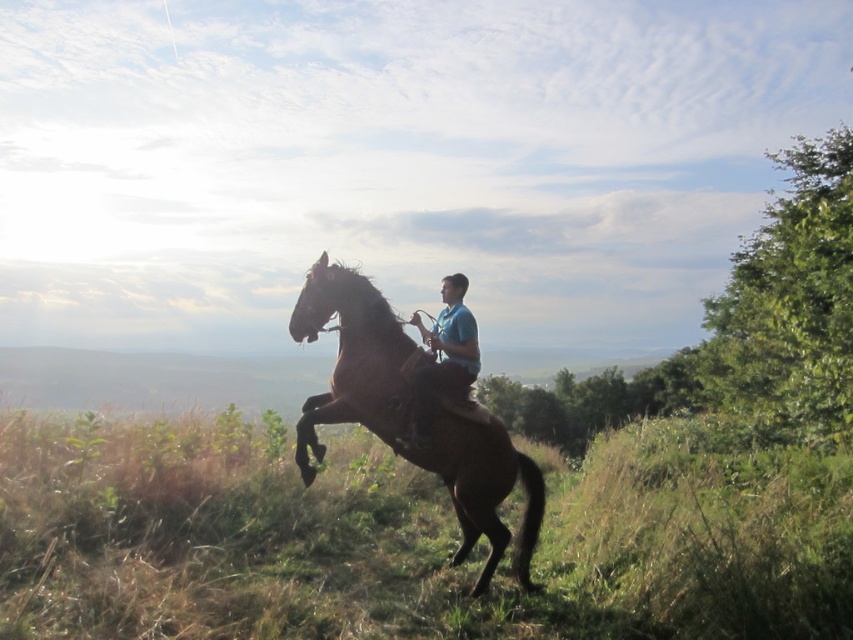
Based on the photo, you are a photographer trying to capture the rider and horse in the scene. You want to ensure the brown grassy at center and the blue smooth shirt at center are both visible in your shot. Based on their positions, which object is closer to the left side of the frame?

The brown grassy at center is positioned to the left of the blue smooth shirt at center, so it is closer to the left side of the frame.

You are a photographer trying to capture the rider and horse in the image. Considering the brown grassy at center and the brown glossy horse at center, which one takes up more visual space in the photo?

The brown glossy horse at center takes up more visual space than the brown grassy at center in the photo.

You are a photographer trying to capture the rider and horse in the image. If you want to frame the blue smooth shirt at center and the brown glossy horse at center so that the horse appears to the left of the shirt in the photo, is this possible based on their current positions?

Yes, because the brown glossy horse at center is already positioned to the left of the blue smooth shirt at center in the scene, so framing them this way would naturally capture their existing arrangement.